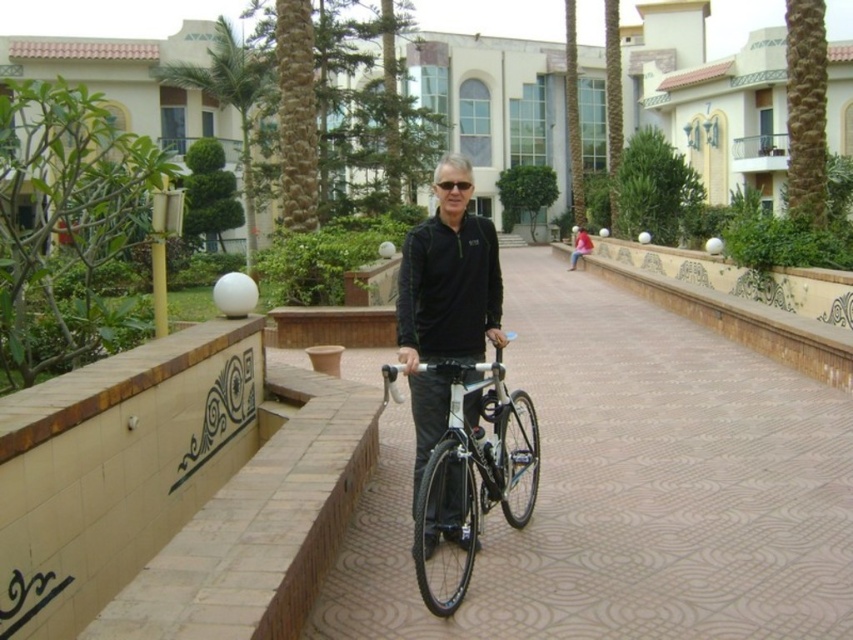
Question: Among these points, which one is nearest to the camera?

Choices:
 (A) (440, 188)
 (B) (572, 561)

Answer: (B)

Question: Does brown brick pavement at center appear on the right side of shiny metallic bicycle at center?

Choices:
 (A) yes
 (B) no

Answer: (A)

Question: Which of the following is the closest to the observer?

Choices:
 (A) white stucco building at upper center
 (B) shiny metallic bicycle at center
 (C) green leafy palm tree at upper left

Answer: (B)

Question: Does brown brick pavement at center have a smaller size compared to green leafy palm tree at upper left?

Choices:
 (A) yes
 (B) no

Answer: (A)

Question: Is shiny metallic bicycle at center closer to camera compared to green leafy palm tree at upper left?

Choices:
 (A) yes
 (B) no

Answer: (A)

Question: Among these points, which one is farthest from the camera?

Choices:
 (A) (431, 458)
 (B) (357, 609)

Answer: (A)